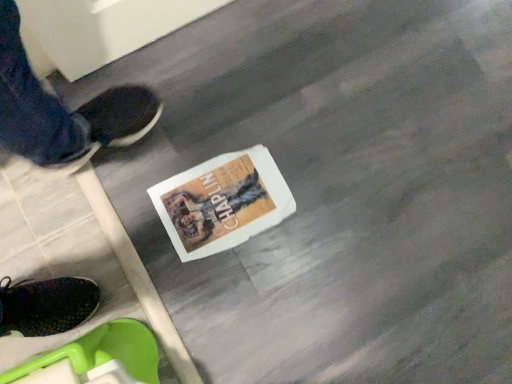
This screenshot has height=384, width=512. I want to click on white paper magazine at center, so click(x=222, y=202).

What do you see at coordinates (222, 202) in the screenshot? This screenshot has height=384, width=512. I see `white paper magazine at center` at bounding box center [222, 202].

Find the location of a particular element. white paper magazine at center is located at coordinates (222, 202).